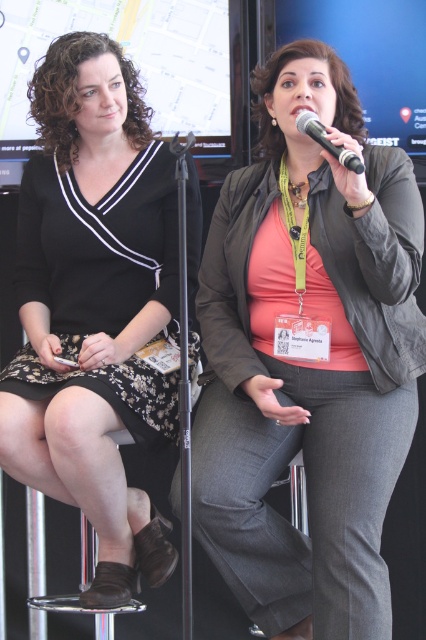
You are a photographer standing at the center of the room. You need to take a photo of the black floral dress at left. Where should you position yourself to ensure the dress is centered in your frame?

Since the black floral dress at left is located at point 0.480 on the x axis and 0.223 on the y axis, you should position yourself so that your camera is aligned with those coordinates to center the dress in the frame.

You are organizing a photoshoot and need to ensure that the orange matte shirt at center and the black plastic microphone at upper center are both visible in the frame. Given their sizes, which object should you prioritize positioning closer to the camera to avoid being too small in the photo?

The black plastic microphone at upper center should be positioned closer to the camera since it is narrower than the orange matte shirt at center, making it appear smaller in the photo if placed at the same distance.